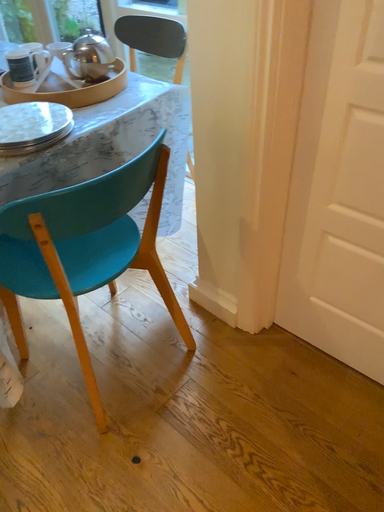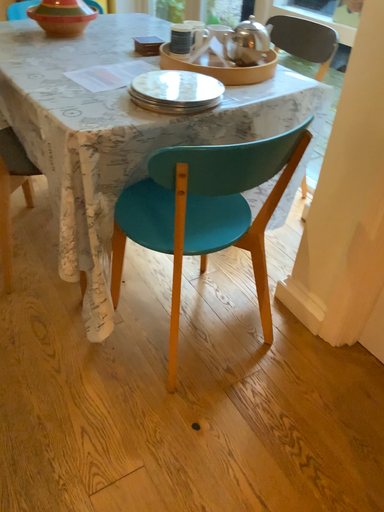
Question: Which way did the camera rotate in the video?

Choices:
 (A) rotated left
 (B) rotated right

Answer: (A)